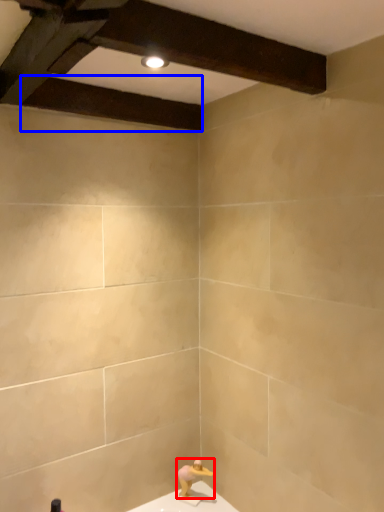
Question: Which object is further to the camera taking this photo, person (highlighted by a red box) or plank (highlighted by a blue box)?

Choices:
 (A) person
 (B) plank

Answer: (A)